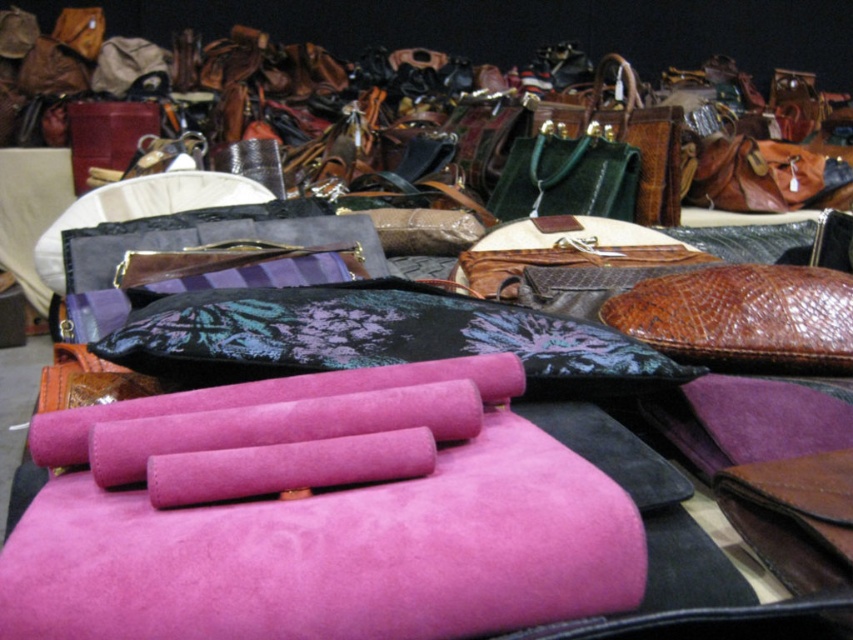
Is point (241, 596) closer to viewer compared to point (125, 339)?

Yes, it is.

Does suede pink yoga mat at center have a larger size compared to black floral-patterned clutch at center?

No.

Which is in front, point (418, 612) or point (204, 372)?

Point (418, 612)

Find the location of `suede pink yoga mat at center`. suede pink yoga mat at center is located at coordinates (334, 554).